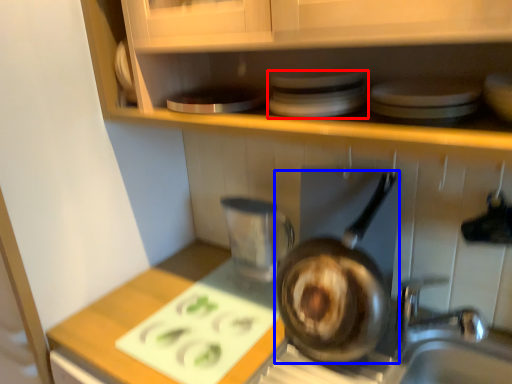
Question: Which object is further to the camera taking this photo, appliance (highlighted by a red box) or frying pan (highlighted by a blue box)?

Choices:
 (A) appliance
 (B) frying pan

Answer: (B)